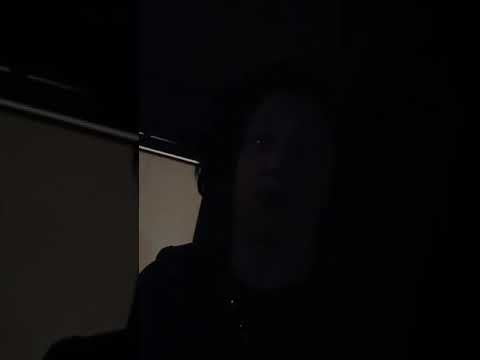
Where is `door frame`? door frame is located at coordinates (173, 153).